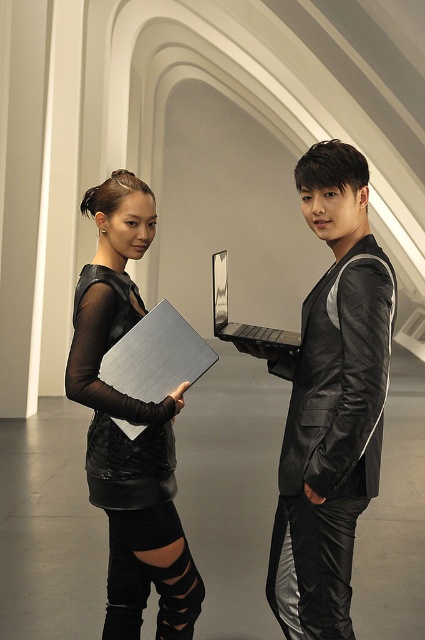
Question: Does black leather jacket at center come in front of matte black dress at center?

Choices:
 (A) no
 (B) yes

Answer: (B)

Question: Can you confirm if metallic silver laptop at center is positioned to the left of black leather jacket at center?

Choices:
 (A) no
 (B) yes

Answer: (B)

Question: Does metallic silver laptop at center appear on the right side of matte black dress at center?

Choices:
 (A) yes
 (B) no

Answer: (A)

Question: Among these objects, which one is farthest from the camera?

Choices:
 (A) black leather jacket at center
 (B) black leather dress at left
 (C) metallic silver laptop at center

Answer: (B)

Question: Which of the following is the closest to the observer?

Choices:
 (A) metallic silver laptop at center
 (B) black leather dress at left
 (C) black leather jacket at center

Answer: (C)

Question: Among these objects, which one is farthest from the camera?

Choices:
 (A) matte black dress at center
 (B) metallic silver laptop at center

Answer: (A)